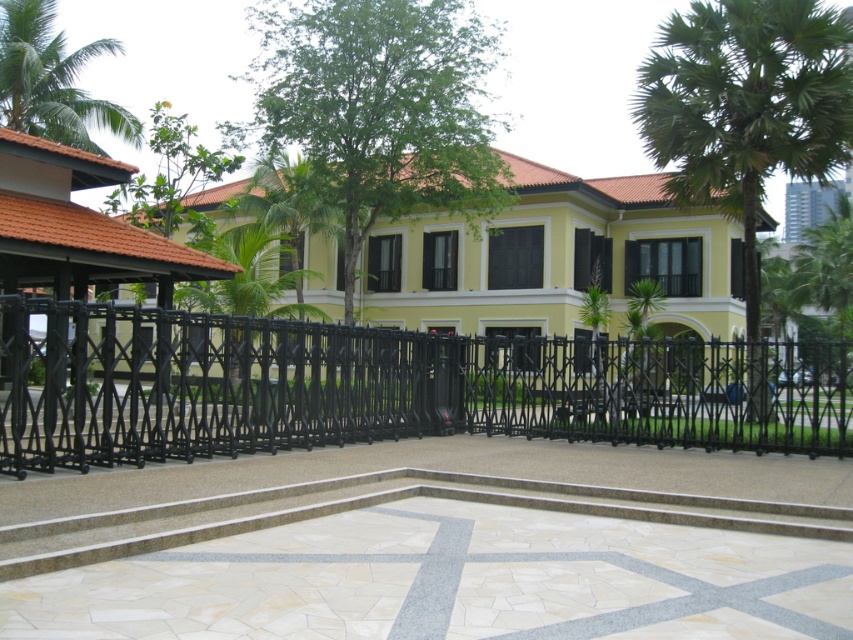
You are a visitor approaching the entrance of the building. You see the black wrought iron gate at center and the matte orange roof at upper left. Which object is closer to you as you approach the building?

The black wrought iron gate at center is closer to you than the matte orange roof at upper left because it is located below it, meaning the gate is positioned in front of the roof from your perspective.

You are a delivery person trying to enter the property through the black wrought iron gate at center. There is a matte orange roof at upper left nearby. Can you estimate if the gate is wide enough for your delivery truck which is 2.5 meters wide?

The black wrought iron gate at center might be wider than matte orange roof at upper left, so it is possible that the gate is wide enough for your delivery truck which is 2.5 meters wide.

You are a visitor approaching the building and want to enter through the entrance. The black wrought iron gate at center and the green leafy tree at upper center are in your line of sight. Which object is closer to you as you approach the building?

The black wrought iron gate at center is closer to you because it is located below the green leafy tree at upper center, meaning the tree is further away.